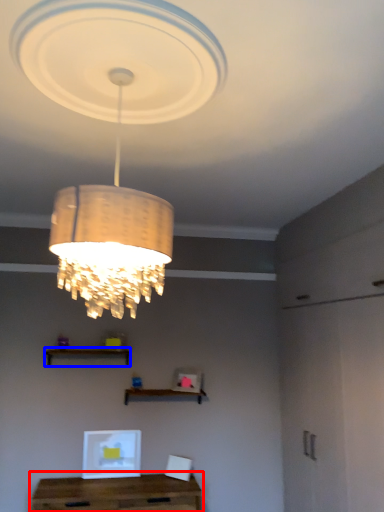
Question: Which of the following is the closest to the observer, table (highlighted by a red box) or shelf (highlighted by a blue box)?

Choices:
 (A) table
 (B) shelf

Answer: (A)